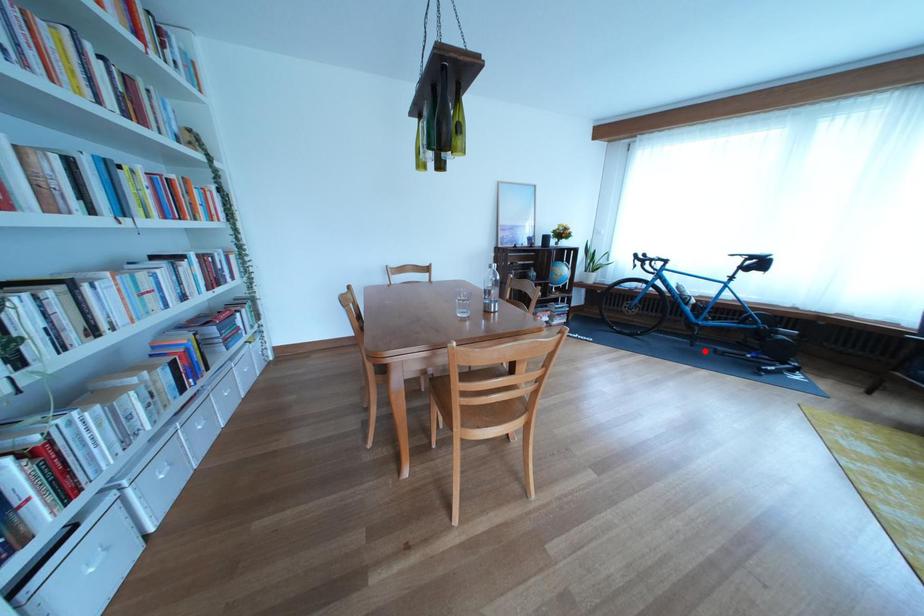
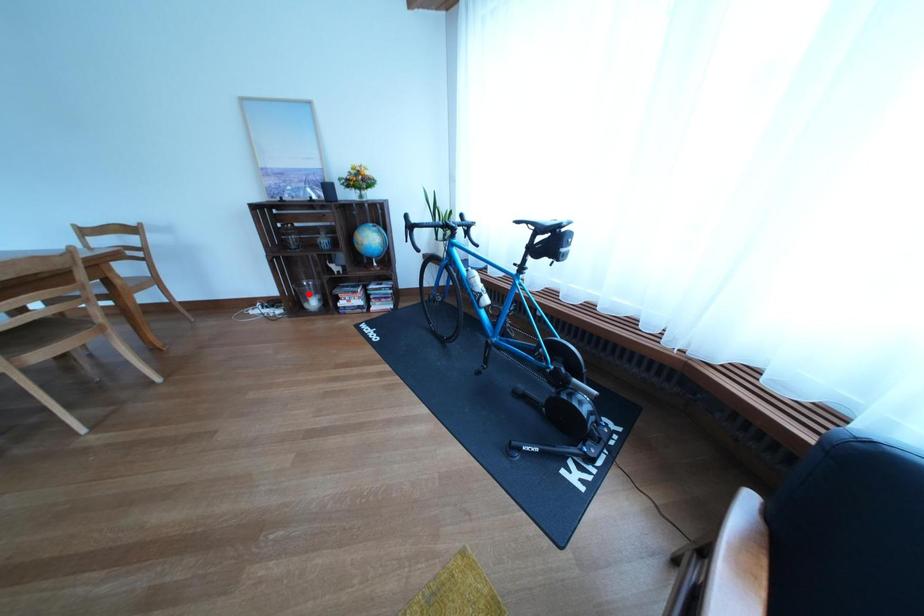
I am providing you with two images of the same scene from different viewpoints. A red point is marked on the first image and another point is marked on the second image. Do the highlighted points in image1 and image2 indicate the same real-world spot?

No